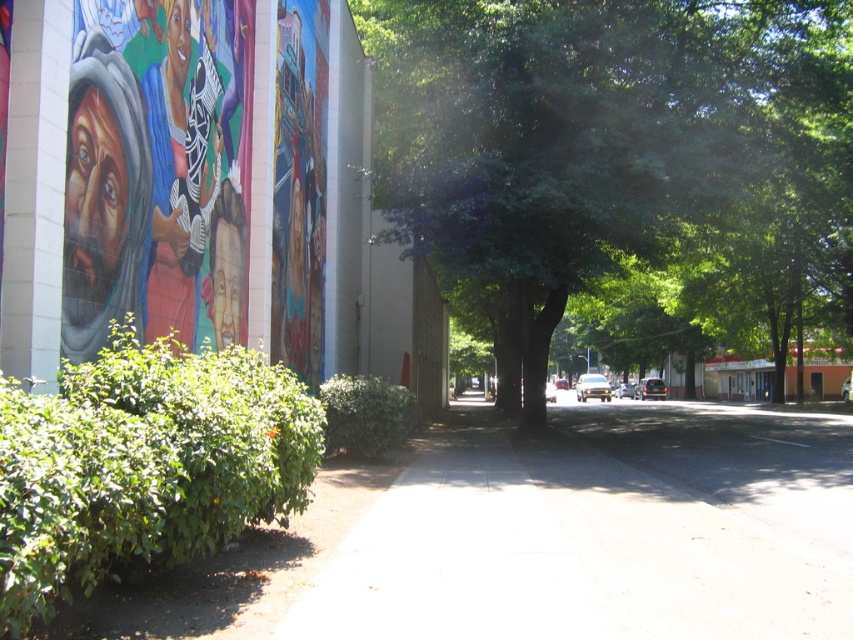
In the scene shown: Is green leafy tree at center above gray concrete sidewalk at center?

Indeed, green leafy tree at center is positioned over gray concrete sidewalk at center.

Is green leafy tree at center bigger than gray concrete sidewalk at center?

Correct, green leafy tree at center is larger in size than gray concrete sidewalk at center.

Does point (503, 275) come farther from viewer compared to point (776, 545)?

Yes, it is.

Locate an element on the screen. The image size is (853, 640). green leafy tree at center is located at coordinates (616, 154).